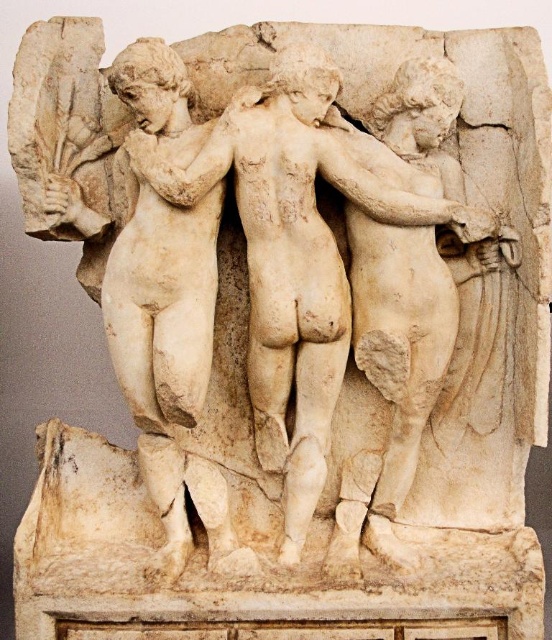
Question: Considering the relative positions of white marble sculpture at center and white marble statue at center in the image provided, where is white marble sculpture at center located with respect to white marble statue at center?

Choices:
 (A) right
 (B) left

Answer: (A)

Question: Among these objects, which one is nearest to the camera?

Choices:
 (A) white marble statue at center
 (B) white marble sculpture at center

Answer: (B)

Question: Among these objects, which one is nearest to the camera?

Choices:
 (A) white marble sculpture at center
 (B) white marble statue at center

Answer: (A)

Question: Can you confirm if white marble sculpture at center is wider than white marble statue at center?

Choices:
 (A) yes
 (B) no

Answer: (A)

Question: Does white marble sculpture at center have a larger size compared to white marble statue at center?

Choices:
 (A) no
 (B) yes

Answer: (B)

Question: Which point appears closest to the camera in this image?

Choices:
 (A) (145, 124)
 (B) (158, 481)

Answer: (A)